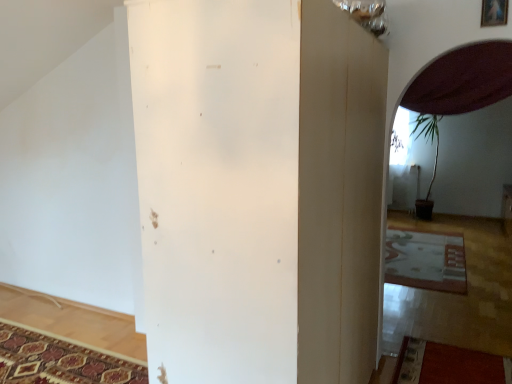
Identify the location of free location above patterned carpet at lower left, placed as the 2th mat when sorted from back to front (from a real-world perspective). This screenshot has height=384, width=512. (46, 358).